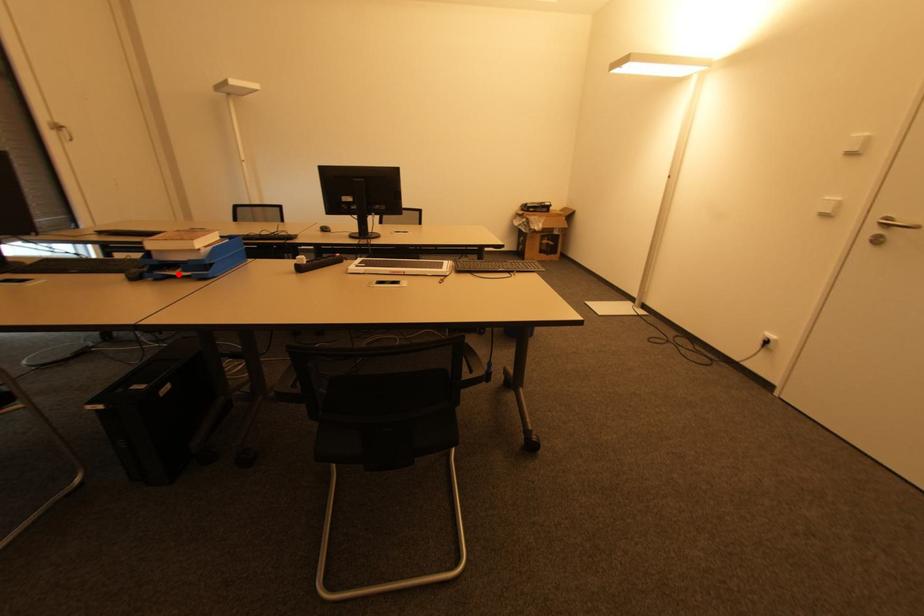
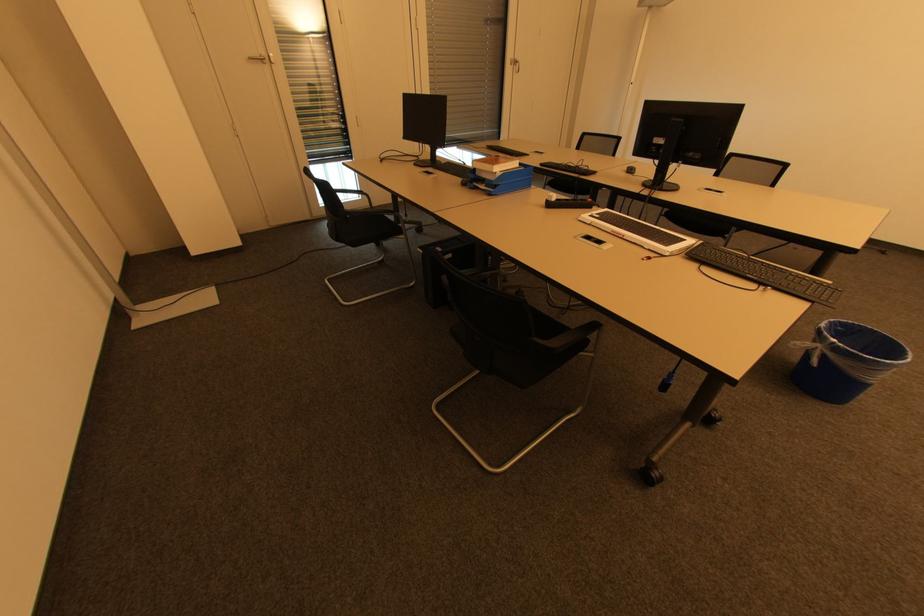
In the second image, find the point that corresponds to the highlighted location in the first image.

(484, 187)